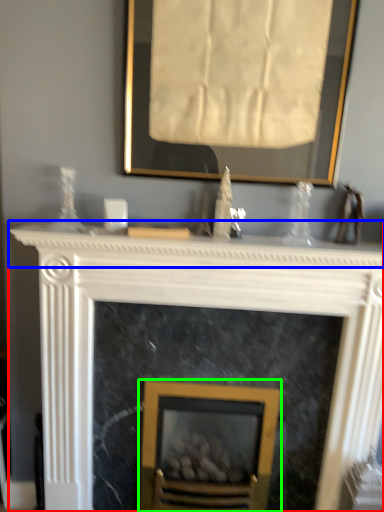
Question: Considering the real-world distances, which object is closest to fireplace (highlighted by a red box)? mantle (highlighted by a blue box) or fireplace (highlighted by a green box).

Choices:
 (A) mantle
 (B) fireplace

Answer: (A)